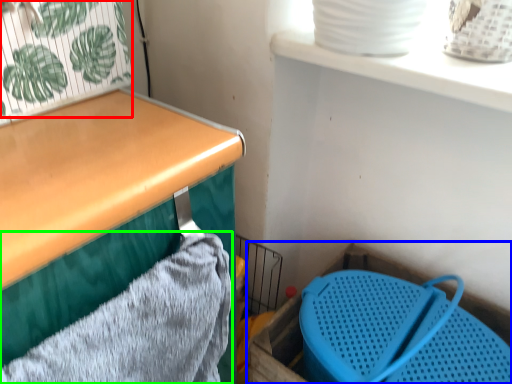
Question: Which is nearer to the plant (highlighted by a red box)? storage box (highlighted by a blue box) or bath towel (highlighted by a green box).

Choices:
 (A) storage box
 (B) bath towel

Answer: (B)